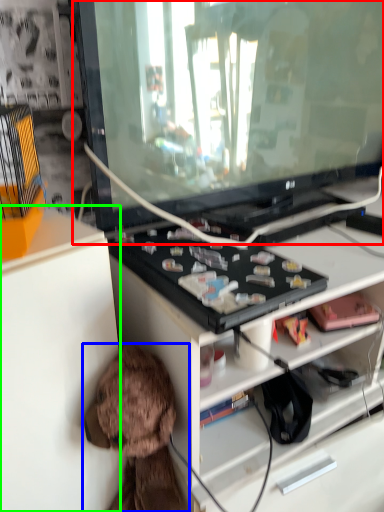
Question: Which object is positioned closest to television (highlighted by a red box)? Select from toy (highlighted by a blue box) and cabinetry (highlighted by a green box).

Choices:
 (A) toy
 (B) cabinetry

Answer: (B)